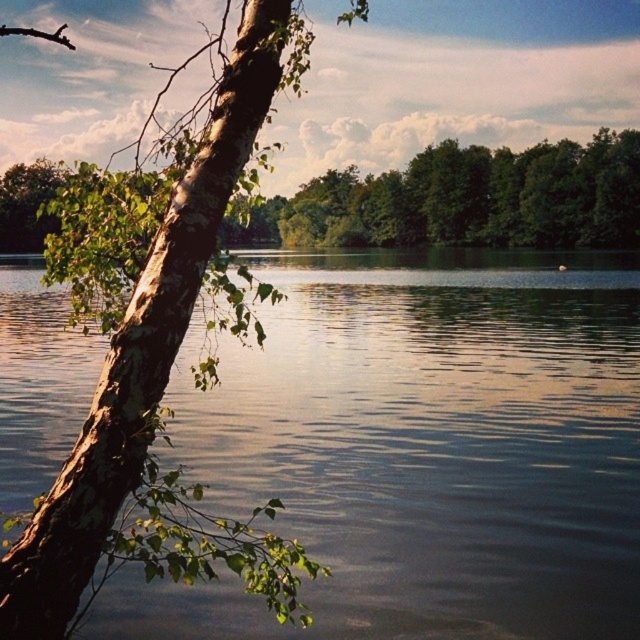
How far apart are smooth water at center and smooth bark tree at left?

86.08 feet

Between point (509, 252) and point (141, 177), which one is positioned behind?

Positioned behind is point (509, 252).

Identify the location of smooth water at center. The height and width of the screenshot is (640, 640). (420, 449).

Where is `smooth water at center`? The height and width of the screenshot is (640, 640). smooth water at center is located at coordinates (420, 449).

Measure the distance between smooth bark tree at left and green bark tree at upper left.

A distance of 152.29 feet exists between smooth bark tree at left and green bark tree at upper left.

Does smooth bark tree at left have a smaller size compared to green bark tree at upper left?

No, smooth bark tree at left is not smaller than green bark tree at upper left.

Is point (200, 563) farther from viewer compared to point (476, 230)?

No, it is in front of (476, 230).

Find the location of a particular element. Image resolution: width=640 pixels, height=640 pixels. smooth bark tree at left is located at coordinates (156, 346).

Who is positioned more to the right, smooth water at center or green bark tree at upper left?

smooth water at center is more to the right.

Looking at this image, does smooth water at center have a greater height compared to green bark tree at upper left?

Incorrect, smooth water at center's height is not larger of green bark tree at upper left's.

Is point (589, 570) positioned before point (532, 164)?

Yes, it is in front of point (532, 164).

I want to click on smooth water at center, so click(420, 449).